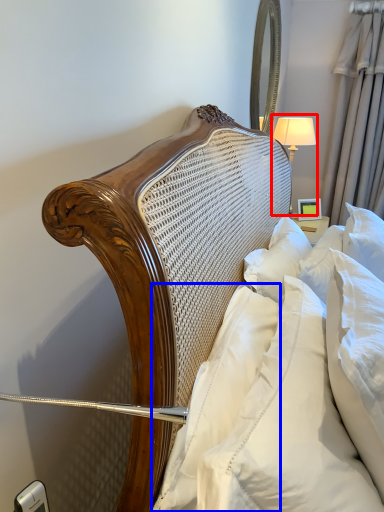
Question: Which point is closer to the camera, bedside lamp (highlighted by a red box) or pillow (highlighted by a blue box)?

Choices:
 (A) bedside lamp
 (B) pillow

Answer: (B)